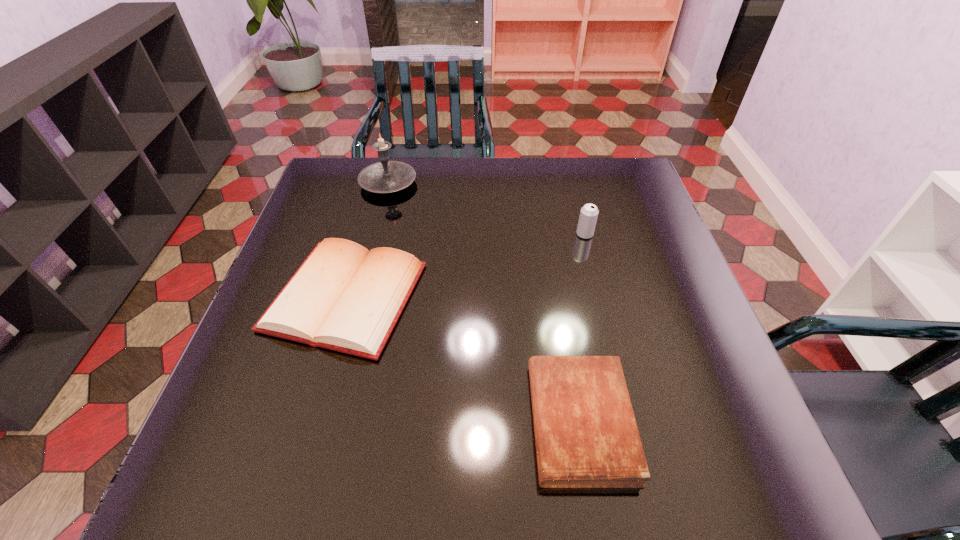
At what (x,y) coordinates should I click in order to perform the action: click on unoccupied area between the farther Bible and the third shortest object. Please return your answer as a coordinate pair (x, y). Looking at the image, I should click on (466, 266).

The image size is (960, 540). I want to click on vacant space that is in between the candle and the shorter Bible, so click(x=484, y=302).

This screenshot has height=540, width=960. I want to click on free space between the nearest object and the tallest object, so click(484, 302).

The width and height of the screenshot is (960, 540). I want to click on free space between the second nearest object and the shortest object, so click(x=463, y=359).

Identify the location of free space between the farther Bible and the tallest object. Image resolution: width=960 pixels, height=540 pixels. (367, 240).

You are a GUI agent. You are given a task and a screenshot of the screen. Output one action in this format:
    pyautogui.click(x=<x>, y=<y>)
    Task: Click on the vacant space that's between the beer can and the farthest object
    
    Given the screenshot: What is the action you would take?
    pyautogui.click(x=487, y=208)

Identify the location of free space between the second nearest object and the candle. (367, 240).

Point out which object is positioned as the second nearest to the right Bible. Please provide its 2D coordinates. Your answer should be formatted as a tuple, i.e. [(x, y)], where the tuple contains the x and y coordinates of a point satisfying the conditions above.

[(588, 216)]

This screenshot has width=960, height=540. I want to click on object that is the third closest one to the farther Bible, so click(588, 216).

The height and width of the screenshot is (540, 960). Identify the location of free space that satisfies the following two spatial constraints: 1. on the front side of the beer can; 2. on the spine side of the shortest object. (632, 422).